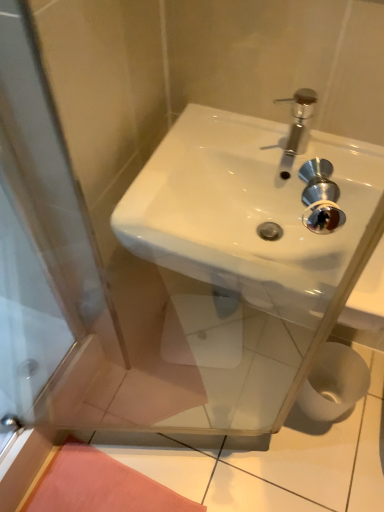
In order to click on free point below white glossy sink at center (from a real-world perspective) in this screenshot , I will do `click(249, 370)`.